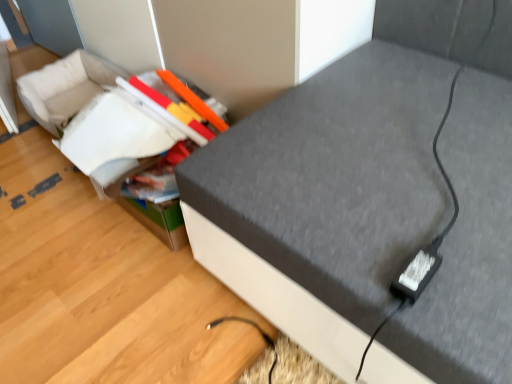
Question: Is matte plastic storage box at center smaller than textured gray sofa at center?

Choices:
 (A) yes
 (B) no

Answer: (A)

Question: Does matte plastic storage box at center have a lesser height compared to textured gray sofa at center?

Choices:
 (A) yes
 (B) no

Answer: (A)

Question: From the image's perspective, is matte plastic storage box at center on top of textured gray sofa at center?

Choices:
 (A) yes
 (B) no

Answer: (B)

Question: Does matte plastic storage box at center have a greater height compared to textured gray sofa at center?

Choices:
 (A) yes
 (B) no

Answer: (B)

Question: Is matte plastic storage box at center thinner than textured gray sofa at center?

Choices:
 (A) no
 (B) yes

Answer: (B)

Question: Considering the positions of textured gray sofa at center and black plastic plug at lower right in the image, is textured gray sofa at center bigger or smaller than black plastic plug at lower right?

Choices:
 (A) small
 (B) big

Answer: (B)

Question: Considering the positions of textured gray sofa at center and black plastic plug at lower right in the image, is textured gray sofa at center taller or shorter than black plastic plug at lower right?

Choices:
 (A) tall
 (B) short

Answer: (A)

Question: Is textured gray sofa at center inside the boundaries of black plastic plug at lower right, or outside?

Choices:
 (A) outside
 (B) inside

Answer: (A)

Question: From the image's perspective, relative to black plastic plug at lower right, is textured gray sofa at center above or below?

Choices:
 (A) below
 (B) above

Answer: (B)

Question: In the image, is black plastic plug at lower right on the left side or the right side of textured gray sofa at center?

Choices:
 (A) right
 (B) left

Answer: (B)

Question: Is black plastic plug at lower right in front of or behind textured gray sofa at center in the image?

Choices:
 (A) front
 (B) behind

Answer: (B)

Question: Looking at their shapes, would you say black plastic plug at lower right is wider or thinner than textured gray sofa at center?

Choices:
 (A) wide
 (B) thin

Answer: (B)

Question: From the image's perspective, is black plastic plug at lower right positioned above or below textured gray sofa at center?

Choices:
 (A) below
 (B) above

Answer: (A)

Question: Is textured gray sofa at center taller or shorter than matte plastic storage box at center?

Choices:
 (A) tall
 (B) short

Answer: (A)

Question: Is textured gray sofa at center wider or thinner than matte plastic storage box at center?

Choices:
 (A) thin
 (B) wide

Answer: (B)